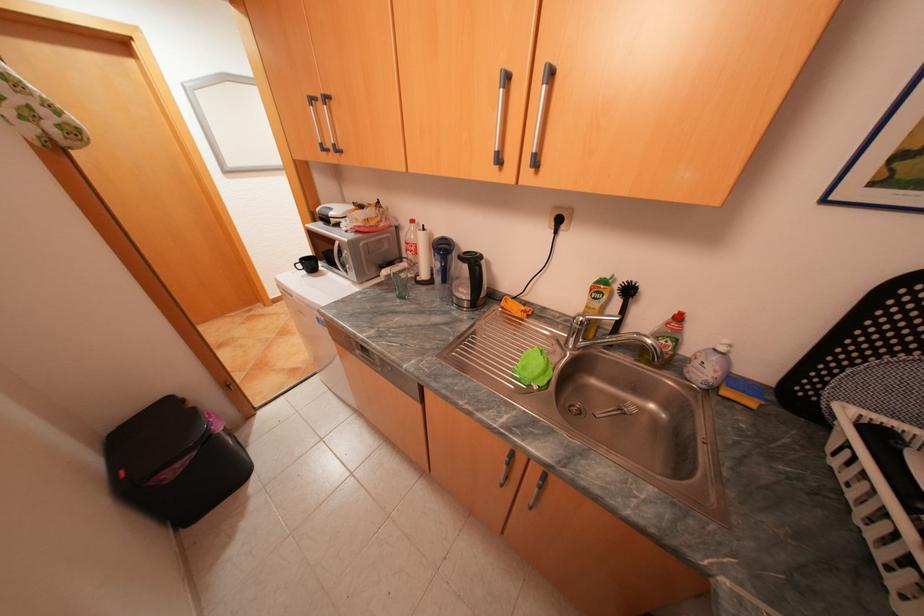
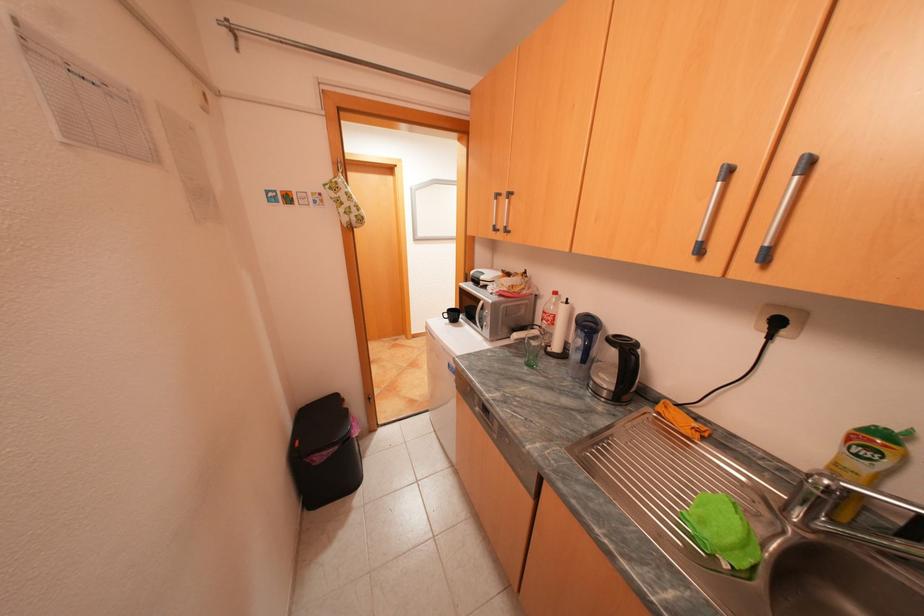
Find the pixel in the second image that matches pixel 187 464 in the first image.

(334, 453)